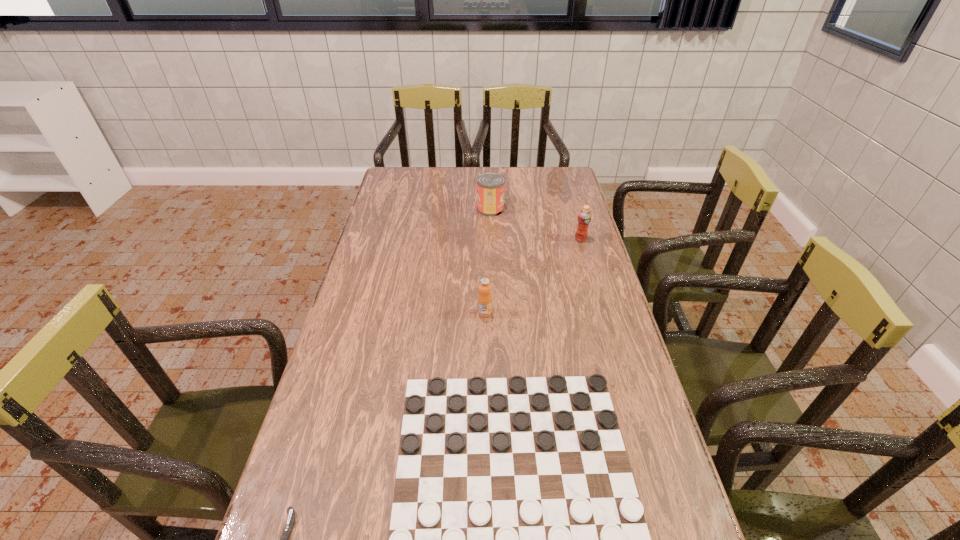
Where is `the rightmost object`? the rightmost object is located at coordinates (584, 217).

This screenshot has width=960, height=540. In order to click on the right orange juice in this screenshot , I will do `click(584, 217)`.

At what (x,y) coordinates should I click in order to perform the action: click on the farthest object. Please return your answer as a coordinate pair (x, y). Looking at the image, I should click on click(x=490, y=186).

You are a GUI agent. You are given a task and a screenshot of the screen. Output one action in this format:
    pyautogui.click(x=<x>, y=<y>)
    Task: Click on the left orange juice
    The height and width of the screenshot is (540, 960).
    Given the screenshot: What is the action you would take?
    pyautogui.click(x=484, y=298)

Find the location of `the nearer orange juice`. the nearer orange juice is located at coordinates (484, 298).

The image size is (960, 540). I want to click on vacant space located on the back of the rightmost object, so click(x=573, y=215).

Where is `free space located 0.350m on the front of the farthest object`? The height and width of the screenshot is (540, 960). free space located 0.350m on the front of the farthest object is located at coordinates (492, 275).

Locate an element on the screen. free spot located on the front label of the third nearest object is located at coordinates (486, 403).

You are a GUI agent. You are given a task and a screenshot of the screen. Output one action in this format:
    pyautogui.click(x=<x>, y=<y>)
    Task: Click on the object that is at the right edge
    
    Given the screenshot: What is the action you would take?
    pyautogui.click(x=584, y=217)

Where is `free space at the far edge of the desktop`? free space at the far edge of the desktop is located at coordinates (514, 185).